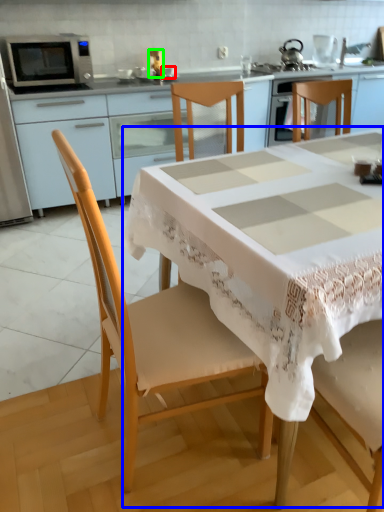
Question: Which object is positioned closest to tableware (highlighted by a red box)? Select from table (highlighted by a blue box) and appliance (highlighted by a green box).

Choices:
 (A) table
 (B) appliance

Answer: (B)